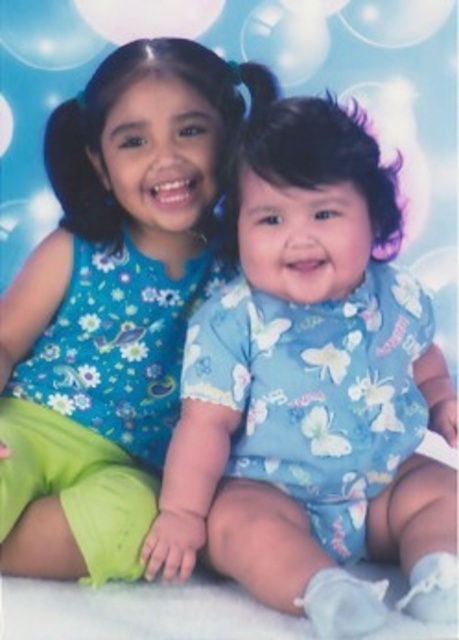
You are standing in front of the image and want to touch the two points mentioned. Which point, point [101,403] or point [151,22], would require you to reach out less to touch it?

Point [101,403] is closer to the viewer than point [151,22], so you would need to reach out less to touch point [101,403].

You are a photographer who needs to adjust the lighting to ensure both the blue fabric baby at center and the transparent plastic bubble at upper center are well lit. Considering their sizes, which object requires a larger light source to illuminate properly?

The blue fabric baby at center is much taller than the transparent plastic bubble at upper center, so it requires a larger light source to illuminate properly.

You are a photographer who wants to ensure both the blue fabric baby at center and the floral fabric dress at upper left are in focus. Which object should you focus on first to ensure the other is also in focus, considering their relative sizes and positions?

The blue fabric baby at center is not as tall as the floral fabric dress at upper left, so you should focus on the floral fabric dress at upper left first to ensure both are in focus.